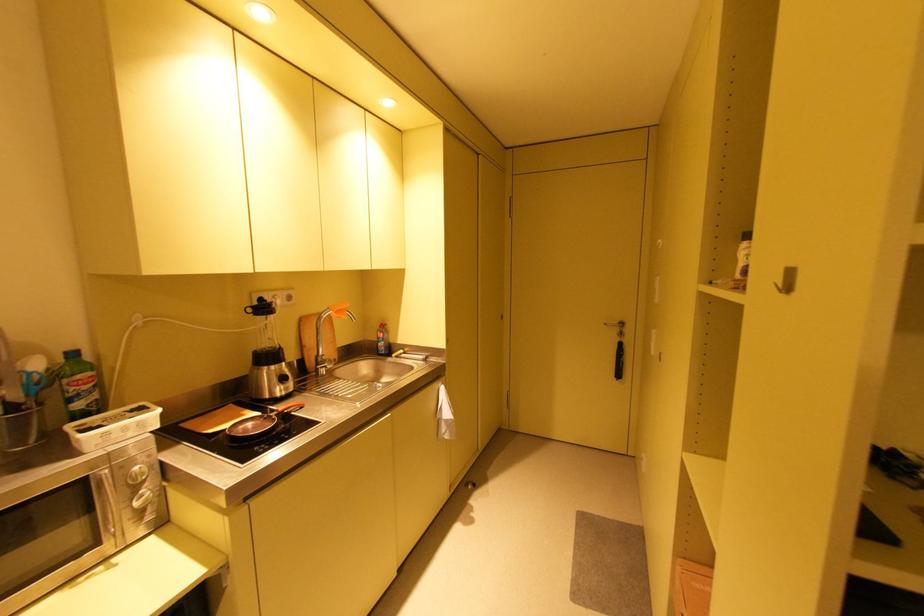
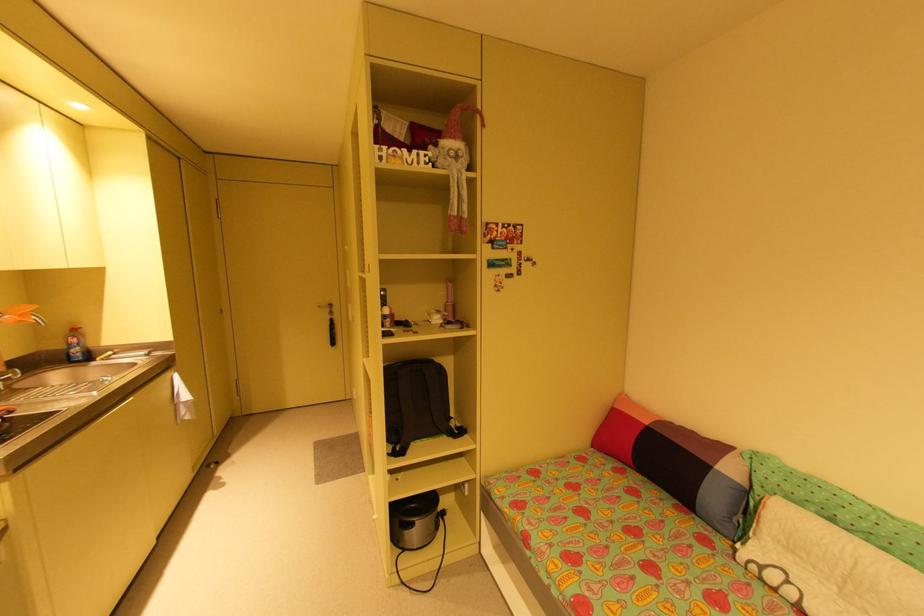
Where in the second image is the point corresponding to the point at 622,330 from the first image?

(333, 310)